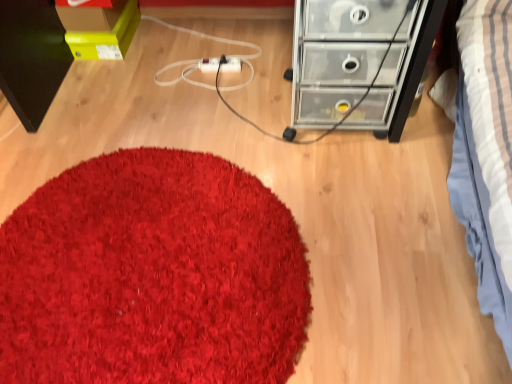
Where is `white plastic extension cord at center`? Image resolution: width=512 pixels, height=384 pixels. white plastic extension cord at center is located at coordinates (220, 65).

Is shaggy red carpet at center positioned in front of transparent plastic chest of drawers at upper right?

Yes, it is.

Is shaggy red carpet at center inside the boundaries of transparent plastic chest of drawers at upper right, or outside?

shaggy red carpet at center is spatially situated outside transparent plastic chest of drawers at upper right.

The height and width of the screenshot is (384, 512). In the image, there is a shaggy red carpet at center. In order to click on the chest of drawers above it (from the image's perspective) in this screenshot , I will do `click(337, 55)`.

Considering the sizes of shaggy red carpet at center and transparent plastic chest of drawers at upper right in the image, is shaggy red carpet at center bigger or smaller than transparent plastic chest of drawers at upper right?

In the image, shaggy red carpet at center appears to be smaller than transparent plastic chest of drawers at upper right.

Is shaggy red carpet at center bigger than white plastic extension cord at center?

Yes.

Can you tell me how much shaggy red carpet at center and white plastic extension cord at center differ in facing direction?

There is a 0.000465-degree angle between the facing directions of shaggy red carpet at center and white plastic extension cord at center.

Can you confirm if shaggy red carpet at center is positioned to the left of white plastic extension cord at center?

Yes.

From a real-world perspective, is shaggy red carpet at center positioned above or below white plastic extension cord at center?

shaggy red carpet at center is situated lower than white plastic extension cord at center in the real world.

Which object is more forward, white plastic extension cord at center or transparent plastic chest of drawers at upper right?

transparent plastic chest of drawers at upper right is closer to the camera.

Could you tell me if white plastic extension cord at center is turned towards transparent plastic chest of drawers at upper right?

No, white plastic extension cord at center does not turn towards transparent plastic chest of drawers at upper right.

Is there a large distance between white plastic extension cord at center and transparent plastic chest of drawers at upper right?

No, there isn't a large distance between white plastic extension cord at center and transparent plastic chest of drawers at upper right.

Is transparent plastic chest of drawers at upper right shorter than white plastic extension cord at center?

No, transparent plastic chest of drawers at upper right is not shorter than white plastic extension cord at center.

From a real-world perspective, does transparent plastic chest of drawers at upper right stand above white plastic extension cord at center?

Yes.

Is point (426, 36) closer or farther from the camera than point (210, 61)?

Point (426, 36).

Would you say transparent plastic chest of drawers at upper right is a long distance from white plastic extension cord at center?

No, transparent plastic chest of drawers at upper right is not far away from white plastic extension cord at center.

Does transparent plastic chest of drawers at upper right turn towards shaggy red carpet at center?

No, transparent plastic chest of drawers at upper right is not facing towards shaggy red carpet at center.

From the image's perspective, between transparent plastic chest of drawers at upper right and shaggy red carpet at center, which one is located above?

transparent plastic chest of drawers at upper right appears higher in the image.

Does point (329, 17) appear closer or farther from the camera than point (80, 323)?

Point (329, 17) appears to be farther away from the viewer than point (80, 323).

From a real-world perspective, is transparent plastic chest of drawers at upper right over shaggy red carpet at center?

Yes, from a real-world perspective, transparent plastic chest of drawers at upper right is above shaggy red carpet at center.

Looking at this image, is white plastic extension cord at center with shaggy red carpet at center?

white plastic extension cord at center and shaggy red carpet at center are clearly separated.

From the image's perspective, between white plastic extension cord at center and shaggy red carpet at center, which one is located above?

white plastic extension cord at center, from the image's perspective.

Considering the relative positions of white plastic extension cord at center and shaggy red carpet at center in the image provided, is white plastic extension cord at center to the right of shaggy red carpet at center from the viewer's perspective?

Correct, you'll find white plastic extension cord at center to the right of shaggy red carpet at center.

At what (x,y) coordinates should I click in order to perform the action: click on the chest of drawers above the shaggy red carpet at center (from the image's perspective). Please return your answer as a coordinate pair (x, y). Image resolution: width=512 pixels, height=384 pixels. Looking at the image, I should click on (337, 55).

Locate an element on the screen. The width and height of the screenshot is (512, 384). mat that is in front of the white plastic extension cord at center is located at coordinates (152, 275).

Looking at the image, which one is located closer to white plastic extension cord at center, shaggy red carpet at center or transparent plastic chest of drawers at upper right?

Based on the image, transparent plastic chest of drawers at upper right appears to be nearer to white plastic extension cord at center.

In the scene shown: Considering their positions, is white plastic extension cord at center positioned closer to transparent plastic chest of drawers at upper right than shaggy red carpet at center?

Among the two, shaggy red carpet at center is located nearer to transparent plastic chest of drawers at upper right.

From the image, which object appears to be nearer to shaggy red carpet at center, transparent plastic chest of drawers at upper right or white plastic extension cord at center?

Based on the image, transparent plastic chest of drawers at upper right appears to be nearer to shaggy red carpet at center.

Which object lies further to the anchor point white plastic extension cord at center, transparent plastic chest of drawers at upper right or shaggy red carpet at center?

shaggy red carpet at center is positioned further to the anchor white plastic extension cord at center.

Looking at the image, which one is located further to transparent plastic chest of drawers at upper right, shaggy red carpet at center or white plastic extension cord at center?

Based on the image, white plastic extension cord at center appears to be further to transparent plastic chest of drawers at upper right.

Which object lies further to the anchor point shaggy red carpet at center, white plastic extension cord at center or transparent plastic chest of drawers at upper right?

The object further to shaggy red carpet at center is white plastic extension cord at center.

Identify the location of chest of drawers between shaggy red carpet at center and white plastic extension cord at center along the z-axis. (337, 55).